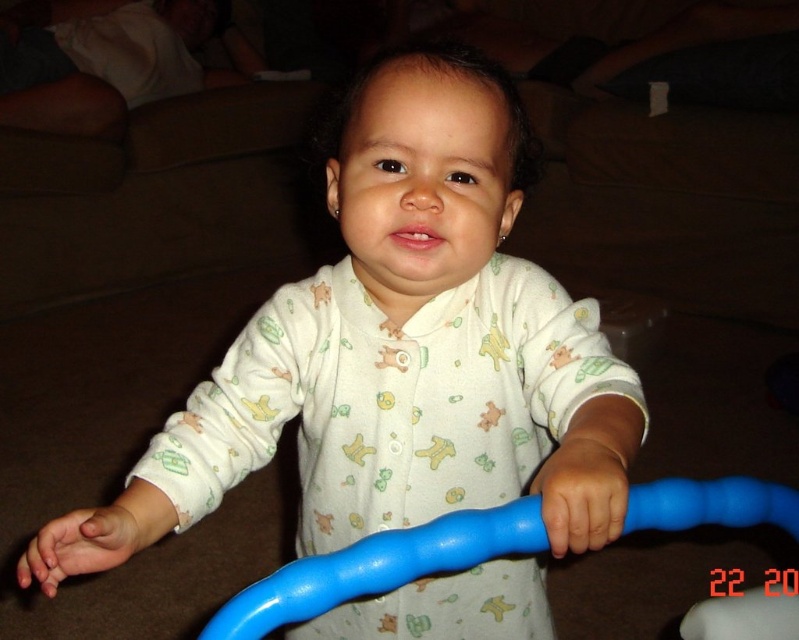
You are a toy designer observing the scene. You need to ensure the blue rubber handle at center is safe for the white soft baby at center to hold. Based on the size comparison, what adjustment might you recommend?

The white soft baby at center has a larger size compared to blue rubber handle at center. To ensure safety, the blue rubber handle at center should be made larger to match the size of the white soft baby at center for a secure grip.

You are a photographer adjusting the focus on your camera. The subject is the child holding the blue plastic hoop. There is a point at coordinates point (423, 116) that you need to check. Is this point within the depth of field if the depth of field extends from 20 inches to 25 inches from the camera?

The point at (423, 116) is 23.11 inches from the camera, which falls within the depth of field range of 20 to 25 inches. Therefore, this point is within the depth of field.

You are a photographer adjusting your camera settings. You notice the point at coordinates (398, 349) in the image. What object is located at this point?

The point at coordinates (398, 349) corresponds to the white soft baby at center.